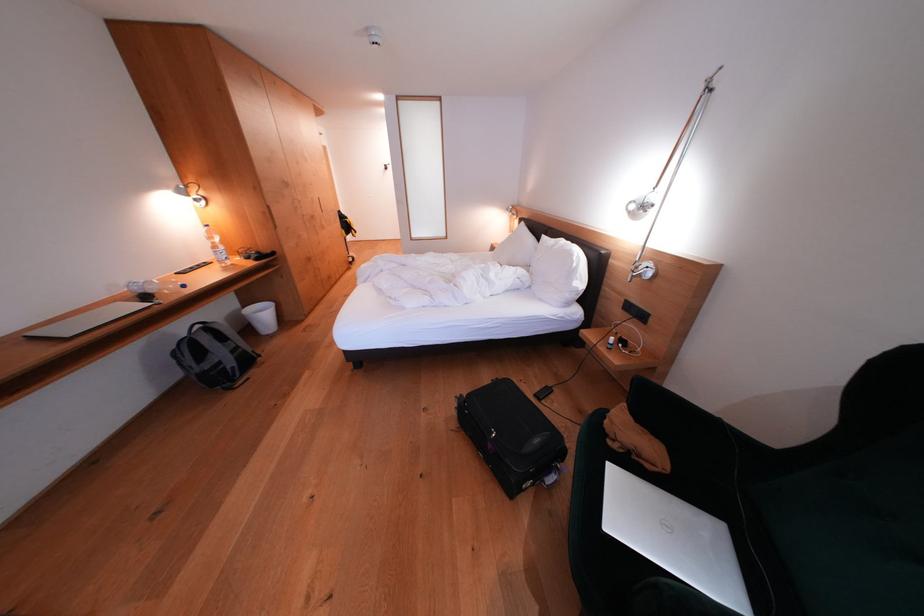
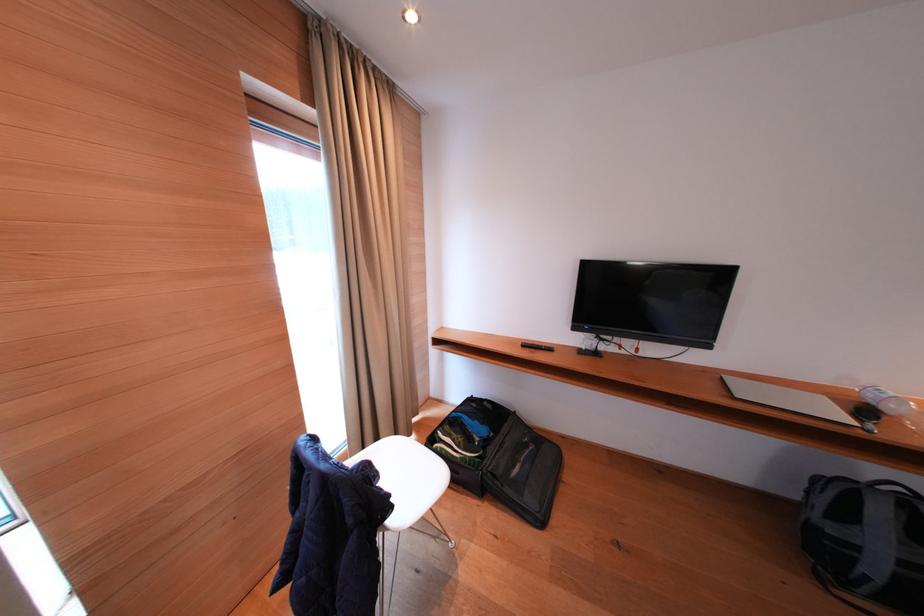
Find the pixel in the second image that matches (x=213, y=344) in the first image.

(888, 515)